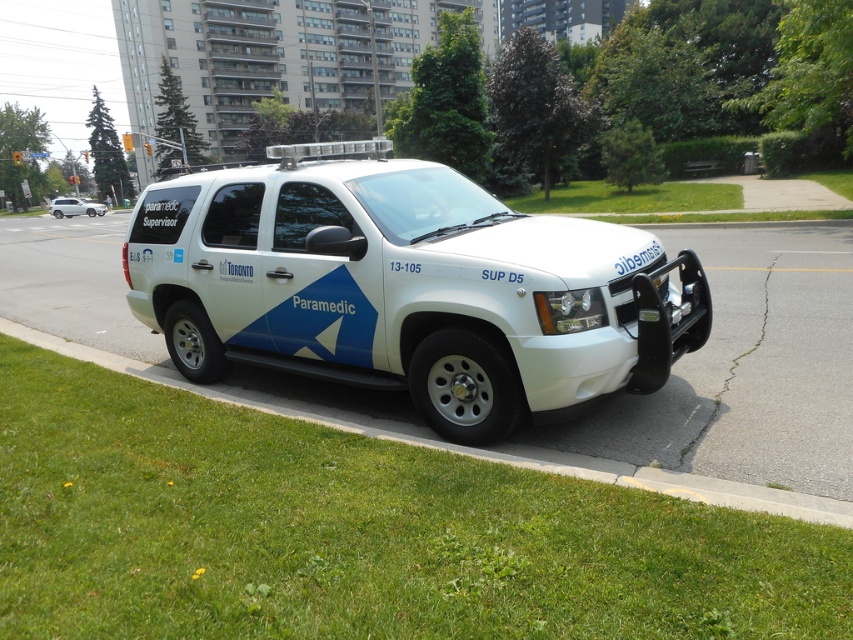
In the scene shown: Which of these two, green grass at lower left or white matte paramedic vehicle at center, stands taller?

With more height is white matte paramedic vehicle at center.

Does green grass at lower left appear on the right side of white matte paramedic vehicle at center?

Correct, you'll find green grass at lower left to the right of white matte paramedic vehicle at center.

Is point (376, 596) positioned before point (90, 209)?

That is True.

Locate an element on the screen. green grass at lower left is located at coordinates (355, 532).

Which is more to the right, green grass at lower left or white matte suv at center?

white matte suv at center

Does green grass at lower left have a greater height compared to white matte suv at center?

No.

Which is in front, point (276, 534) or point (525, 304)?

Point (276, 534) is more forward.

Locate an element on the screen. This screenshot has width=853, height=640. green grass at lower left is located at coordinates (355, 532).

Between white matte suv at center and white matte paramedic vehicle at center, which one is positioned higher?

white matte paramedic vehicle at center is higher up.

Between white matte suv at center and white matte paramedic vehicle at center, which one has less height?

white matte suv at center

Describe the element at coordinates (405, 285) in the screenshot. I see `white matte suv at center` at that location.

This screenshot has height=640, width=853. Identify the location of white matte suv at center. (405, 285).